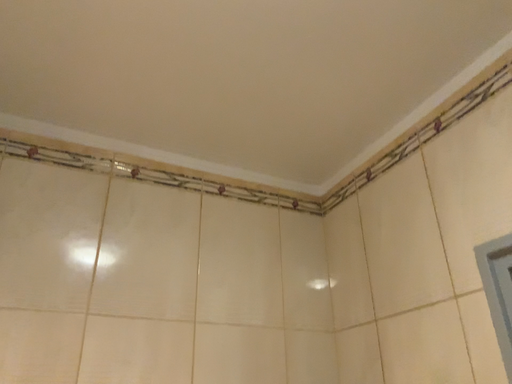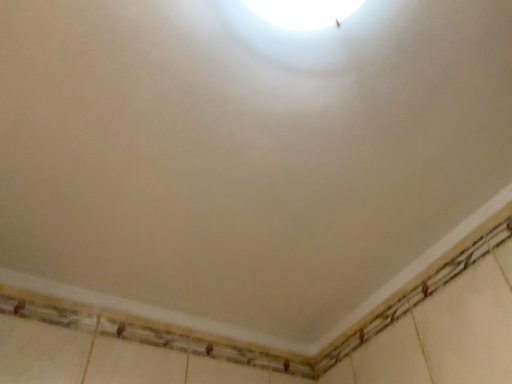
Question: Which way did the camera rotate in the video?

Choices:
 (A) rotated downward
 (B) rotated upward

Answer: (B)